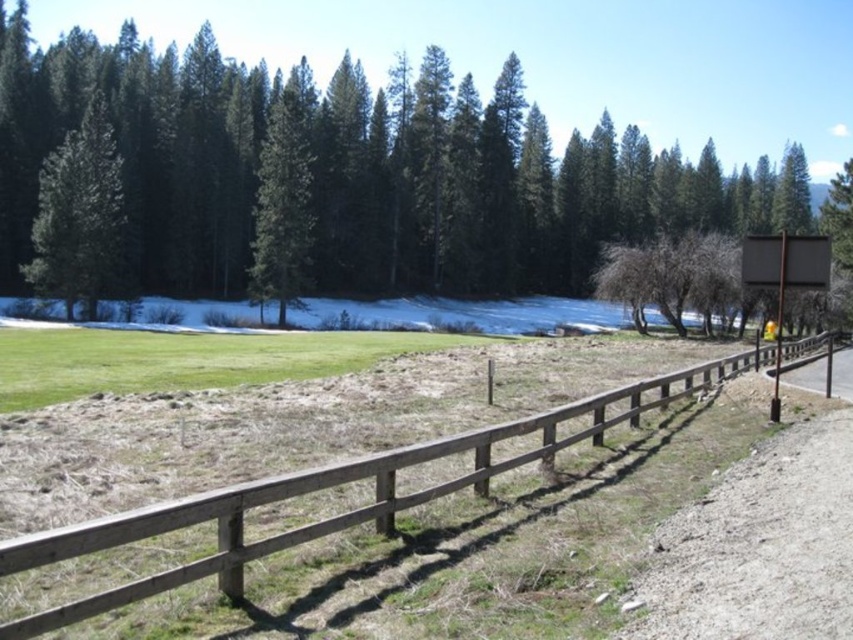
Question: Considering the relative positions of wooden fence at center and green matte tree at upper left in the image provided, where is wooden fence at center located with respect to green matte tree at upper left?

Choices:
 (A) right
 (B) left

Answer: (A)

Question: Is wooden fence at center to the left of green matte tree at center from the viewer's perspective?

Choices:
 (A) no
 (B) yes

Answer: (A)

Question: Which object is farther from the camera taking this photo?

Choices:
 (A) green matte tree at center
 (B) wooden fence at center
 (C) green coniferous trees at upper center

Answer: (A)

Question: Which of the following is the farthest from the observer?

Choices:
 (A) (276, 294)
 (B) (96, 266)
 (C) (679, 385)

Answer: (A)

Question: Observing the image, what is the correct spatial positioning of green coniferous trees at upper center in reference to green matte tree at upper left?

Choices:
 (A) right
 (B) left

Answer: (A)

Question: Which of the following is the farthest from the observer?

Choices:
 (A) (16, 260)
 (B) (35, 227)
 (C) (144, 536)

Answer: (A)